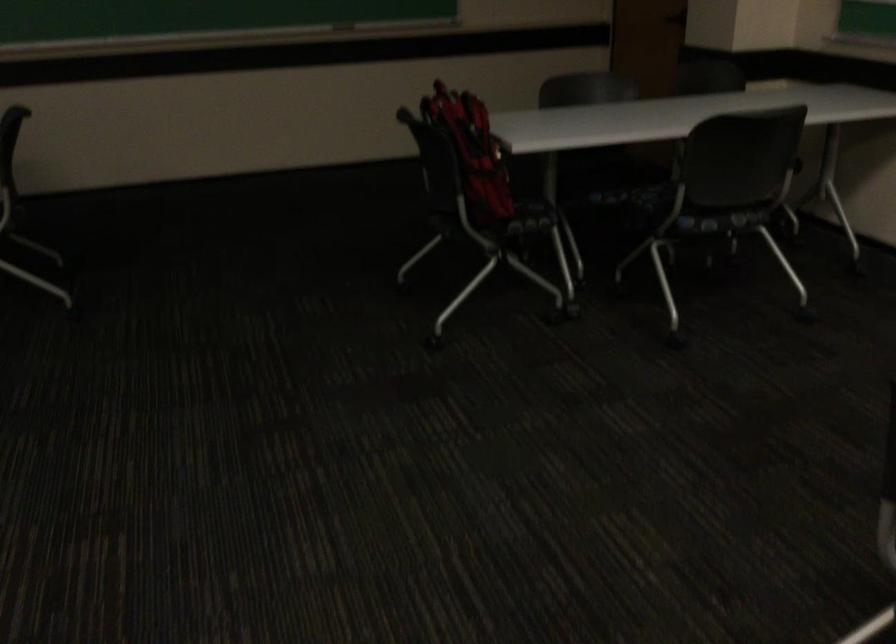
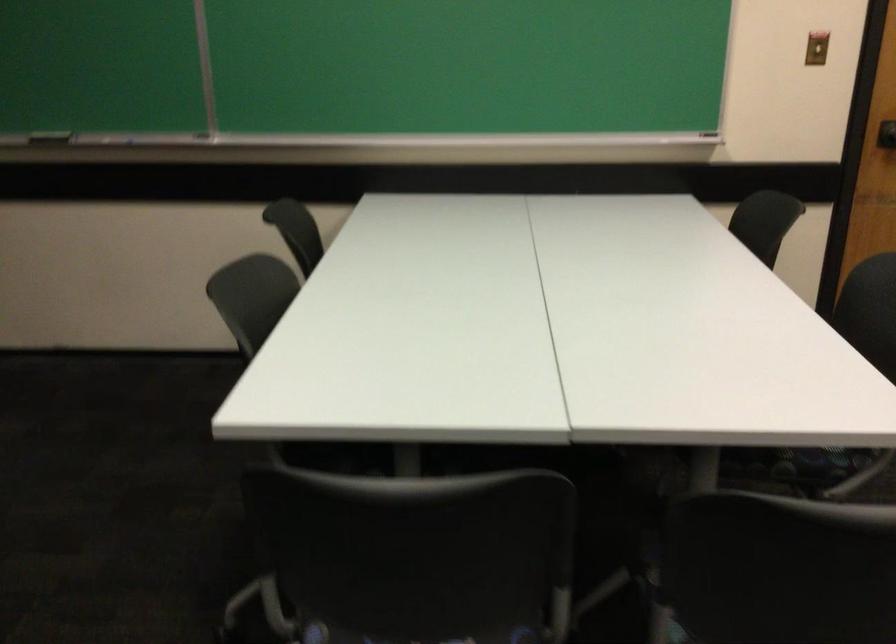
Question: Based on the continuous images, in which direction is the camera rotating? Reply with the corresponding letter.

Choices:
 (A) Left
 (B) Right
 (C) Up
 (D) Down

Answer: (B)